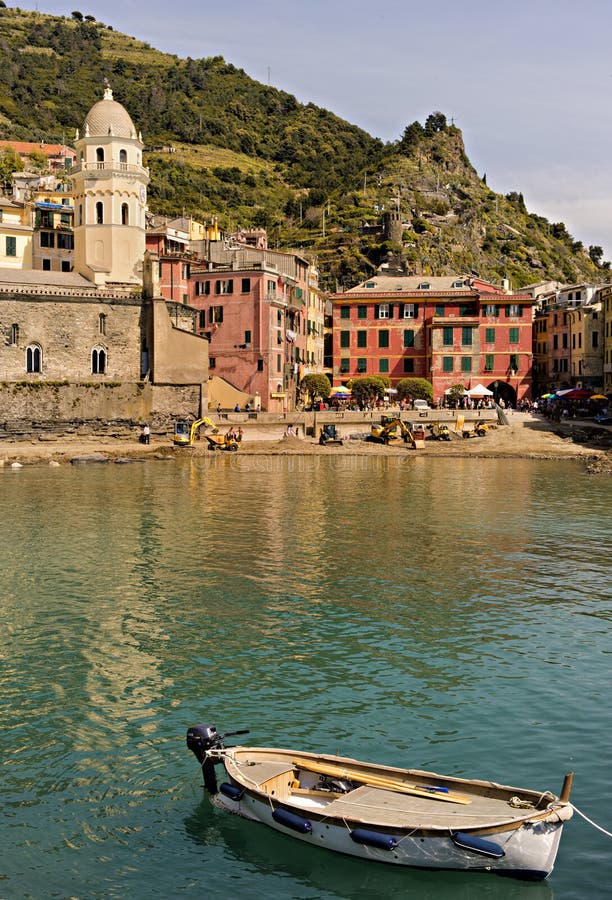
The width and height of the screenshot is (612, 900). Find the location of `window`. window is located at coordinates (359, 338).